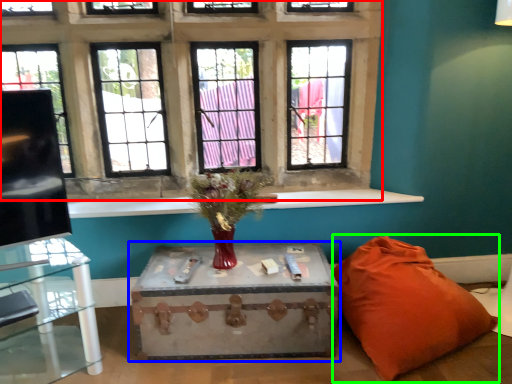
Question: Based on their relative distances, which object is nearer to window (highlighted by a red box)? Choose from table (highlighted by a blue box) and pillow (highlighted by a green box).

Choices:
 (A) table
 (B) pillow

Answer: (A)